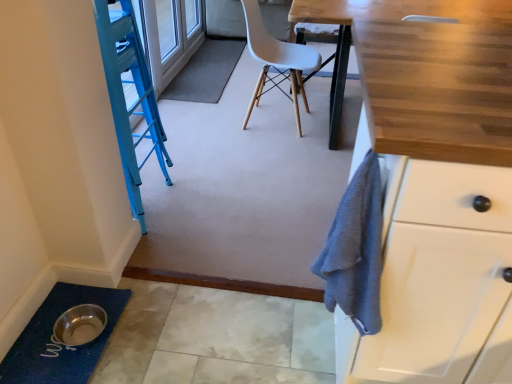
Question: From the image's perspective, is gray carpet at center, the 2th bath mat positioned from the front, above blue textured bath mat at lower left, positioned as the 1th bath mat in front-to-back order?

Choices:
 (A) yes
 (B) no

Answer: (A)

Question: Is gray carpet at center, the 1th bath mat positioned from the top, aimed at blue textured bath mat at lower left, the 1th bath mat ordered from the bottom?

Choices:
 (A) no
 (B) yes

Answer: (A)

Question: Can you confirm if gray carpet at center, the 2th bath mat from the bottom, is smaller than blue textured bath mat at lower left, the 2th bath mat viewed from the back?

Choices:
 (A) no
 (B) yes

Answer: (A)

Question: Is gray carpet at center, the 2th bath mat positioned from the front, further to camera compared to blue textured bath mat at lower left, the 2th bath mat viewed from the back?

Choices:
 (A) yes
 (B) no

Answer: (A)

Question: Can you confirm if gray carpet at center, the 1th bath mat positioned from the top, is shorter than blue textured bath mat at lower left, the 1th bath mat ordered from the bottom?

Choices:
 (A) no
 (B) yes

Answer: (B)

Question: Which is correct: white plastic chair at center is inside gray carpet at center, the 2th bath mat from the bottom, or outside of it?

Choices:
 (A) inside
 (B) outside

Answer: (B)

Question: Considering the relative positions of white plastic chair at center and gray carpet at center, the 2th bath mat from the bottom, in the image provided, is white plastic chair at center to the left or to the right of gray carpet at center, the 2th bath mat from the bottom,?

Choices:
 (A) left
 (B) right

Answer: (B)

Question: From the image's perspective, is white plastic chair at center positioned above or below gray carpet at center, the 2th bath mat from the bottom?

Choices:
 (A) below
 (B) above

Answer: (A)

Question: In terms of width, does white plastic chair at center look wider or thinner when compared to gray carpet at center, the 2th bath mat from the bottom?

Choices:
 (A) thin
 (B) wide

Answer: (B)

Question: Looking at their shapes, would you say blue textured bath mat at lower left, the 1th bath mat ordered from the bottom, is wider or thinner than white plastic chair at center?

Choices:
 (A) thin
 (B) wide

Answer: (A)

Question: Considering the positions of blue textured bath mat at lower left, the 2th bath mat viewed from the back, and white plastic chair at center in the image, is blue textured bath mat at lower left, the 2th bath mat viewed from the back, bigger or smaller than white plastic chair at center?

Choices:
 (A) small
 (B) big

Answer: (A)

Question: From the image's perspective, is blue textured bath mat at lower left, the 2th bath mat in the top-to-bottom sequence, above or below white plastic chair at center?

Choices:
 (A) above
 (B) below

Answer: (B)

Question: Do you think blue textured bath mat at lower left, positioned as the 1th bath mat in front-to-back order, is within white plastic chair at center, or outside of it?

Choices:
 (A) outside
 (B) inside

Answer: (A)

Question: In the image, is gray carpet at center, the 2th bath mat from the bottom, positioned in front of or behind blue textured bath mat at lower left, the 2th bath mat in the top-to-bottom sequence?

Choices:
 (A) front
 (B) behind

Answer: (B)

Question: Based on their positions, is gray carpet at center, the 1th bath mat positioned from the top, located to the left or right of blue textured bath mat at lower left, the 1th bath mat ordered from the bottom?

Choices:
 (A) right
 (B) left

Answer: (A)